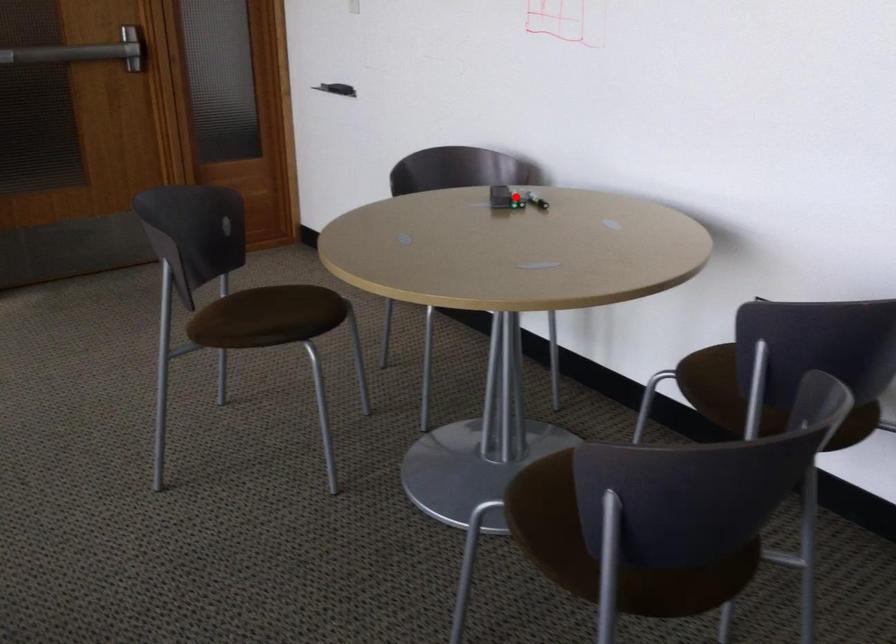
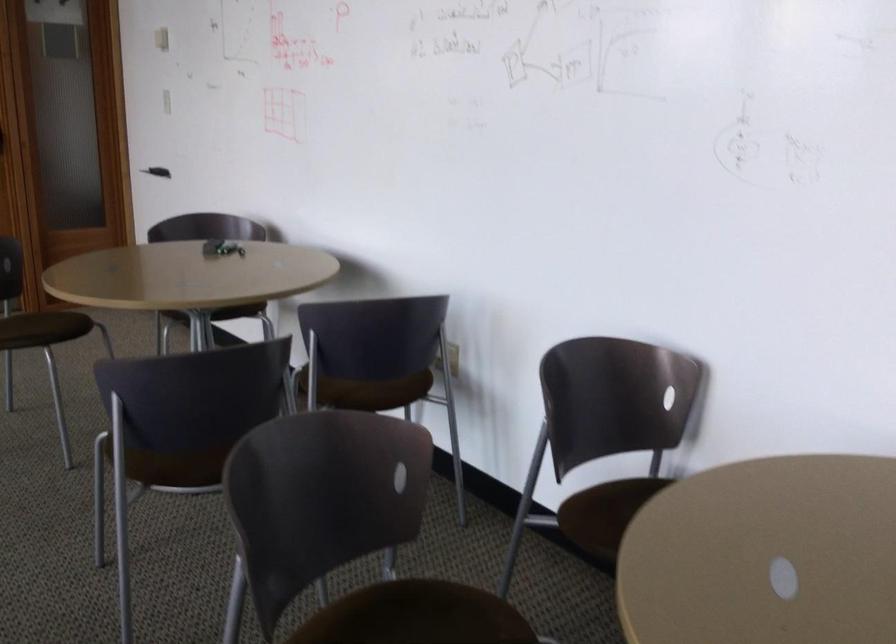
Question: I am providing you with two images of the same scene from different viewpoints. A red point is marked on the first image. Is the red point's position out of view in image 2?

Choices:
 (A) Yes
 (B) No

Answer: (A)